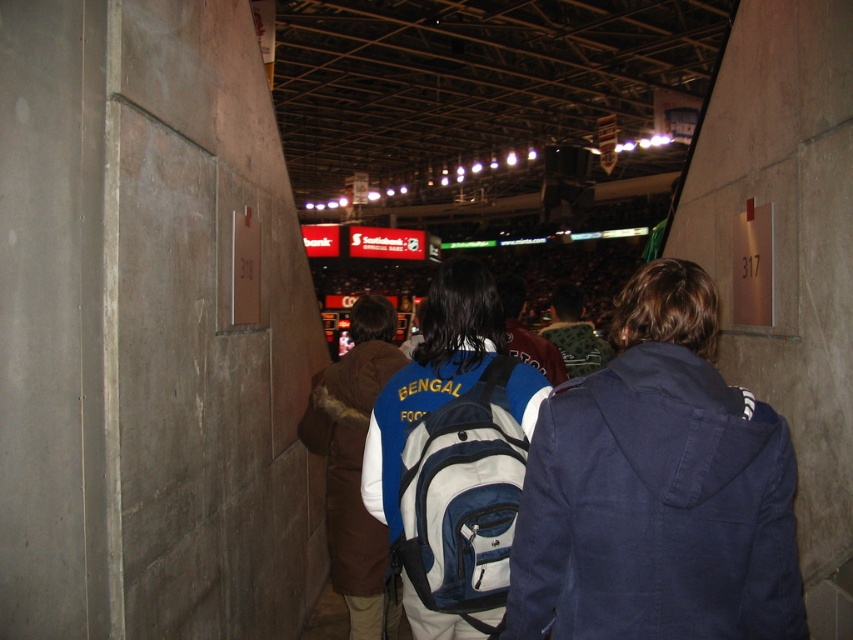
You are navigating through a corridor in a sports arena and need to reach the exit located at the end of the corridor. There is a navy blue jacket at center in your path. Based on its position, can you estimate how far you are from the exit?

The navy blue jacket at center is located at point (657, 490), which suggests it is relatively close to the exit. Since the coordinates are near the center of the corridor, you are likely within a short distance from the exit.

You are standing in the corridor and want to pass through to the arena entrance. There is a blue fabric backpack at center and a dark blue jacket at center in your way. Can you walk between them?

The blue fabric backpack at center is positioned on the left side of dark blue jacket at center, so there is space between them for you to walk through.